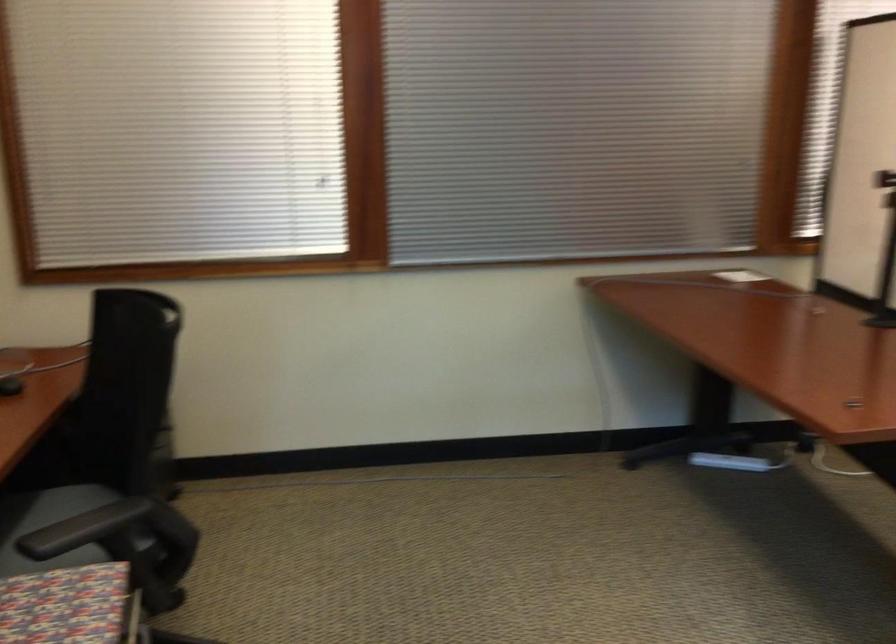
Locate an element on the screen. This screenshot has height=644, width=896. black chair armrest is located at coordinates (83, 529).